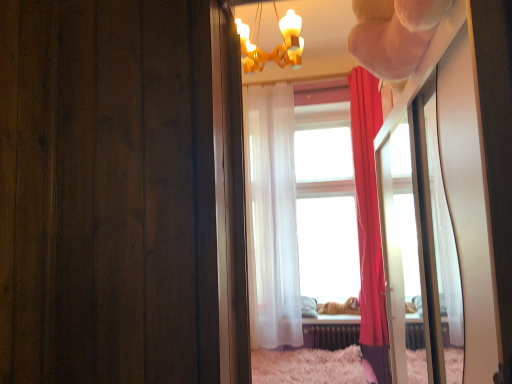
Question: Is point (297, 337) positioned closer to the camera than point (265, 56)?

Choices:
 (A) farther
 (B) closer

Answer: (A)

Question: From the image's perspective, is translucent white curtain at center, acting as the first curtain starting from the left, located above or below gold textured chandelier at upper center?

Choices:
 (A) above
 (B) below

Answer: (B)

Question: Estimate the real-world distances between objects in this image. Which object is farther from the white glossy mirror at upper right?

Choices:
 (A) gold textured chandelier at upper center
 (B) metallic radiator at lower center
 (C) translucent white curtain at center, acting as the first curtain starting from the left
 (D) golden fur dog at center
 (E) silky red curtain at right, which is the first curtain from right to left

Answer: (D)

Question: Which of these objects is positioned farthest from the metallic radiator at lower center?

Choices:
 (A) gold textured chandelier at upper center
 (B) translucent white curtain at center, acting as the first curtain starting from the left
 (C) golden fur dog at center
 (D) silky red curtain at right, which is the first curtain from right to left
 (E) white glossy mirror at upper right

Answer: (A)